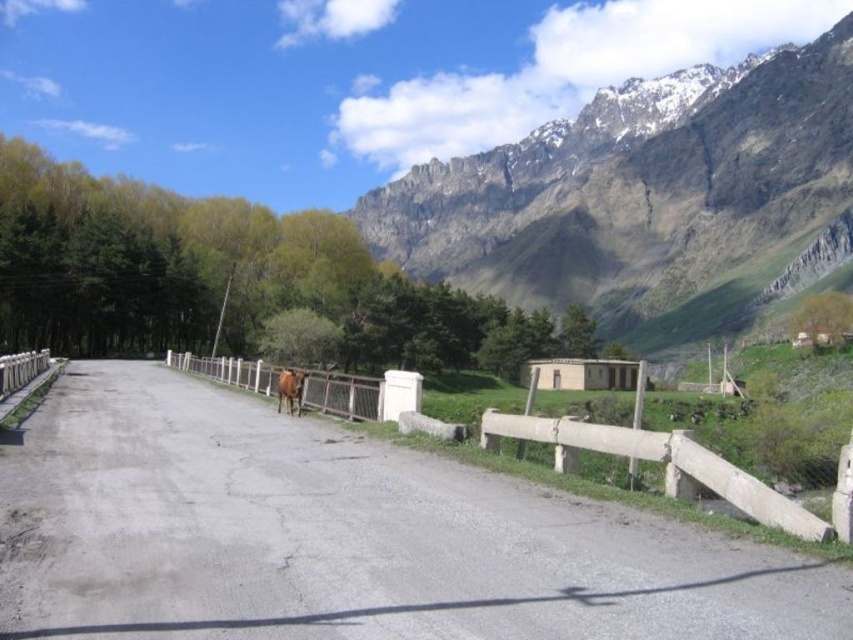
Is rugged stone mountain at upper right in front of brown glossy horse at center?

No, rugged stone mountain at upper right is further to the viewer.

In order to click on rugged stone mountain at upper right in this screenshot , I will do `click(639, 195)`.

At what (x,y) coordinates should I click in order to perform the action: click on rugged stone mountain at upper right. Please return your answer as a coordinate pair (x, y). Image resolution: width=853 pixels, height=640 pixels. Looking at the image, I should click on (639, 195).

Between gray asphalt road at center and brown glossy horse at center, which one appears on the right side from the viewer's perspective?

gray asphalt road at center

Between gray asphalt road at center and brown glossy horse at center, which one appears on the left side from the viewer's perspective?

Positioned to the left is brown glossy horse at center.

Where is `gray asphalt road at center`? The image size is (853, 640). gray asphalt road at center is located at coordinates (341, 536).

Between gray asphalt road at center and rugged stone mountain at upper right, which one has more height?

rugged stone mountain at upper right is taller.

Measure the distance between gray asphalt road at center and camera.

gray asphalt road at center and camera are 88.55 feet apart.

I want to click on gray asphalt road at center, so click(x=341, y=536).